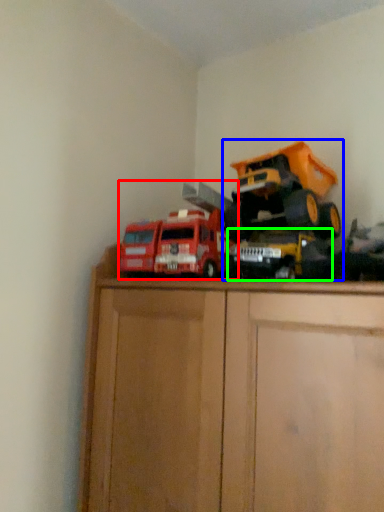
Question: Considering the real-world distances, which object is closest to toy (highlighted by a red box)? toy (highlighted by a blue box) or toy (highlighted by a green box).

Choices:
 (A) toy
 (B) toy

Answer: (B)